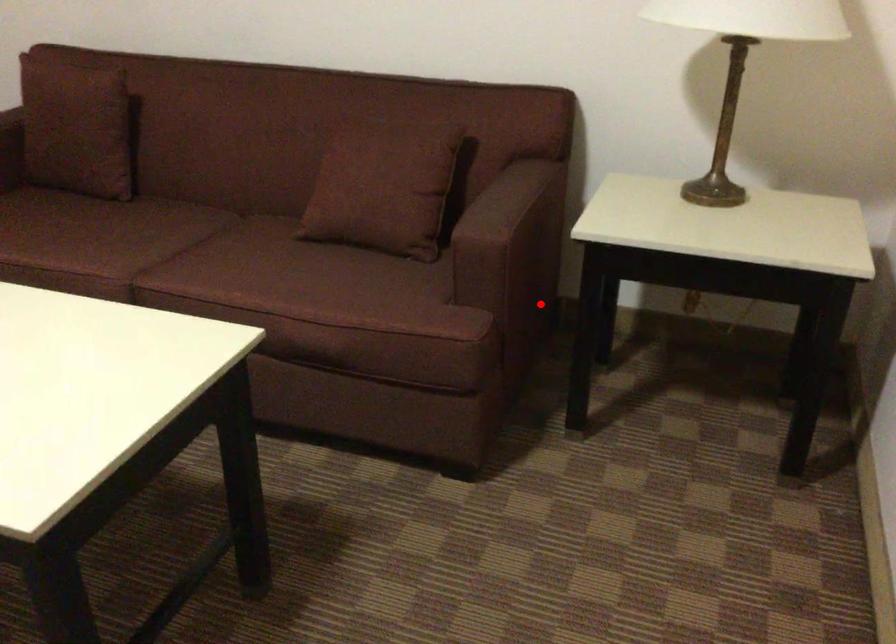
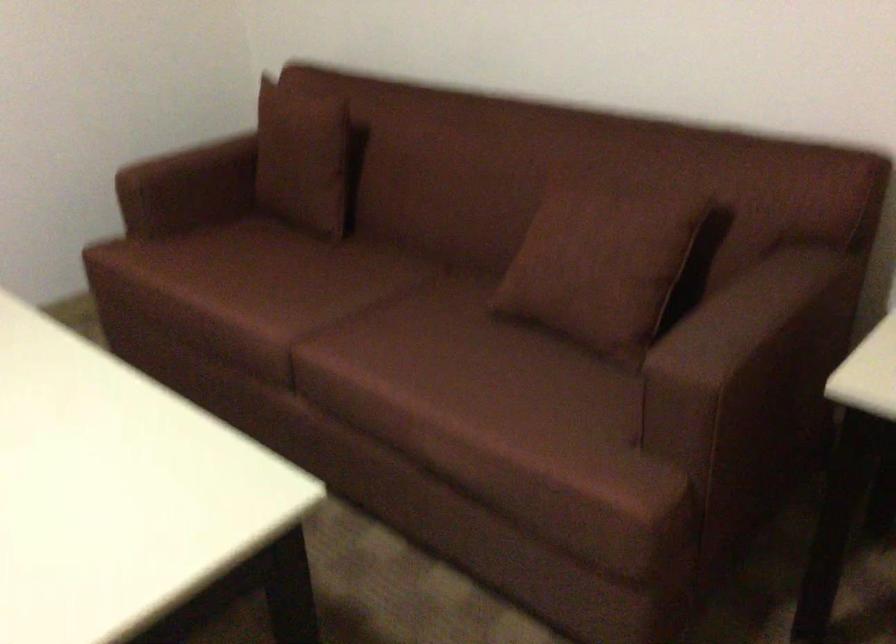
Question: I am providing you with two images of the same scene from different viewpoints. In image1, a red point is highlighted. Considering the same 3D point in image2, which of the following is correct?

Choices:
 (A) It is closer
 (B) It is farther

Answer: (A)